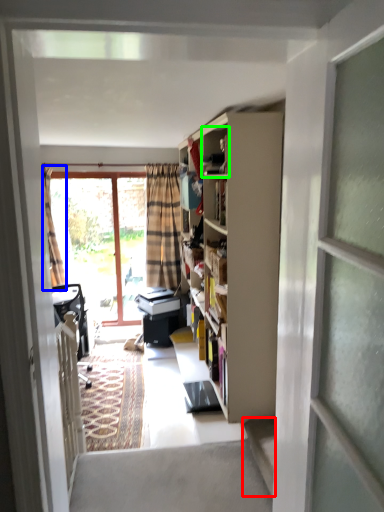
Question: Considering the real-world distances, which object is closest to stairwell (highlighted by a red box)? curtain (highlighted by a blue box) or cabinet (highlighted by a green box).

Choices:
 (A) curtain
 (B) cabinet

Answer: (B)